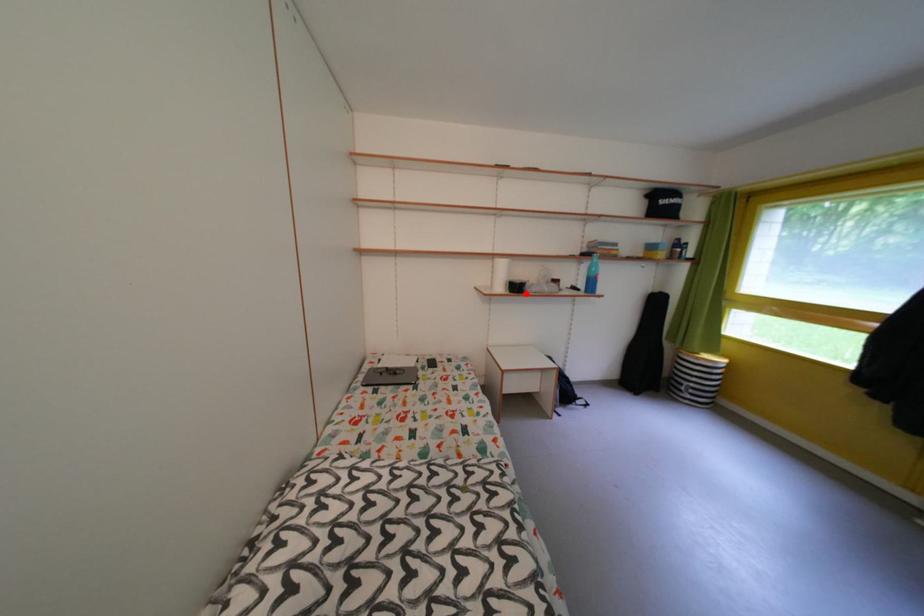
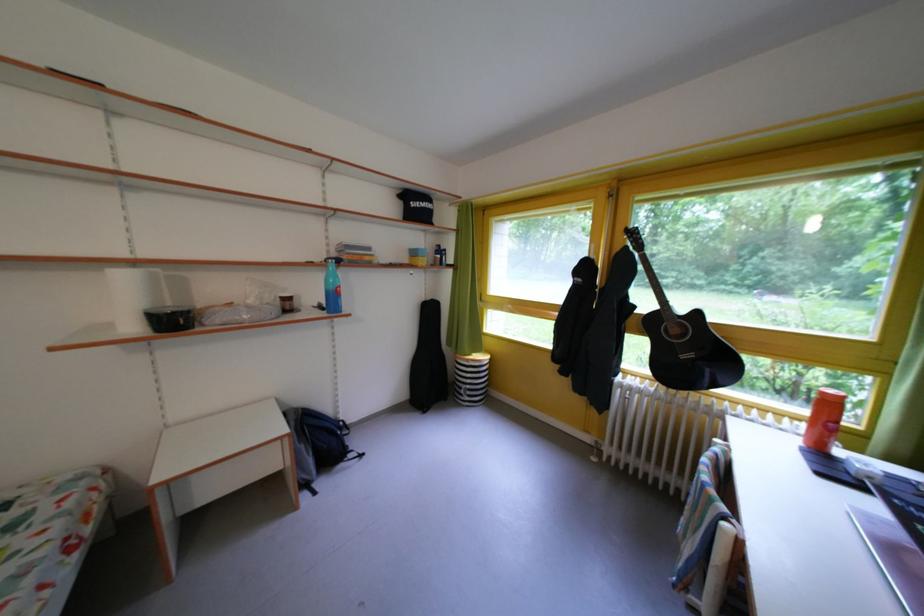
Where in the second image is the point corresponding to the highlighted location from the first image?

(184, 328)